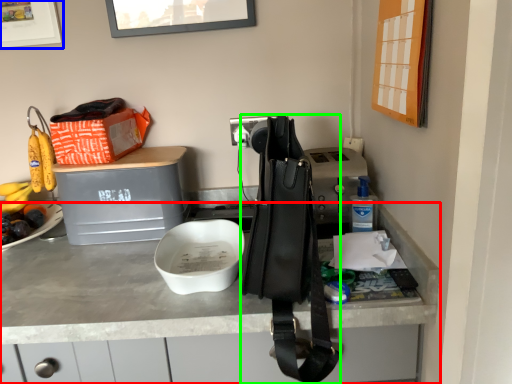
Question: Estimate the real-world distances between objects in this image. Which object is farther from desk (highlighted by a red box), picture frame (highlighted by a blue box) or handbag (highlighted by a green box)?

Choices:
 (A) picture frame
 (B) handbag

Answer: (A)